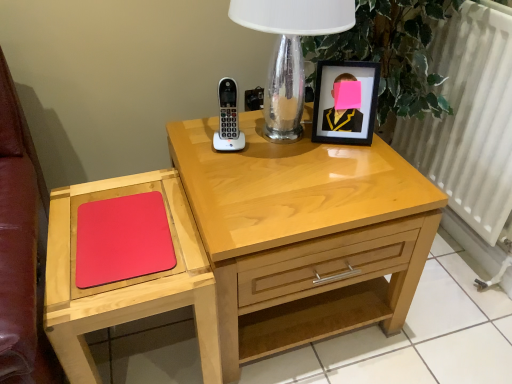
I want to click on white plastic phone at center, so click(x=228, y=119).

The width and height of the screenshot is (512, 384). In order to click on matte wood mouse pad at left in this screenshot , I will do `click(128, 287)`.

What do you see at coordinates (469, 118) in the screenshot? The width and height of the screenshot is (512, 384). I see `white metallic radiator at right` at bounding box center [469, 118].

Where is `white metallic radiator at right`? white metallic radiator at right is located at coordinates (469, 118).

Based on the photo, in order to face light wood nightstand at center, should I rotate leftwards or rightwards?

Turn right by 4.321 degrees to look at light wood nightstand at center.

In order to face matte black picture frame at upper right, should I rotate leftwards or rightwards?

Turn right by 11.741 degrees to look at matte black picture frame at upper right.

Image resolution: width=512 pixels, height=384 pixels. What do you see at coordinates (345, 102) in the screenshot?
I see `matte black picture frame at upper right` at bounding box center [345, 102].

This screenshot has width=512, height=384. In order to click on white plastic phone at center in this screenshot , I will do `click(228, 119)`.

Does white metallic radiator at right lie in front of light wood nightstand at center?

No, it is not.

In the scene shown: Is white metallic radiator at right aimed at light wood nightstand at center?

Yes, white metallic radiator at right is oriented towards light wood nightstand at center.

From the image's perspective, which one is positioned lower, white metallic radiator at right or light wood nightstand at center?

light wood nightstand at center appears lower in the image.

Considering the positions of point (442, 66) and point (264, 210), is point (442, 66) closer or farther from the camera than point (264, 210)?

Point (442, 66) appears to be farther away from the viewer than point (264, 210).

Considering the positions of point (99, 261) and point (297, 46), is point (99, 261) closer or farther from the camera than point (297, 46)?

Point (99, 261) is positioned closer to the camera compared to point (297, 46).

Which is in front, rubberized matte red mousepad at left or clear glass table lamp at upper center?

Positioned in front is rubberized matte red mousepad at left.

Find the location of a particular element. table lamp that appears on the right of rubberized matte red mousepad at left is located at coordinates (290, 51).

Is clear glass table lamp at upper center wider or thinner than matte wood mouse pad at left?

clear glass table lamp at upper center is thinner than matte wood mouse pad at left.

Considering the positions of point (284, 39) and point (147, 291), is point (284, 39) closer or farther from the camera than point (147, 291)?

Point (284, 39) appears to be farther away from the viewer than point (147, 291).

Is clear glass table lamp at upper center further to the viewer compared to matte wood mouse pad at left?

Yes, clear glass table lamp at upper center is further from the camera.

Is clear glass table lamp at upper center smaller than matte wood mouse pad at left?

Indeed, clear glass table lamp at upper center has a smaller size compared to matte wood mouse pad at left.

In the scene shown: Does light wood nightstand at center turn towards clear glass table lamp at upper center?

No, light wood nightstand at center does not turn towards clear glass table lamp at upper center.

Find the location of a particular element. The image size is (512, 384). table lamp above the light wood nightstand at center (from a real-world perspective) is located at coordinates (290, 51).

From a real-world perspective, which object stands above the other?

In real-world perspective, clear glass table lamp at upper center is above.

Consider the image. Between light wood nightstand at center and clear glass table lamp at upper center, which one has larger width?

Wider between the two is light wood nightstand at center.

Is rubberized matte red mousepad at left not within white plastic phone at center?

Indeed, rubberized matte red mousepad at left is completely outside white plastic phone at center.

Which is behind, point (143, 209) or point (231, 146)?

The point (231, 146) is behind.

How different are the orientations of rubberized matte red mousepad at left and white plastic phone at center in degrees?

11.8 degrees separate the facing orientations of rubberized matte red mousepad at left and white plastic phone at center.

Which object is positioned more to the left, rubberized matte red mousepad at left or white plastic phone at center?

rubberized matte red mousepad at left.

From the image's perspective, which object appears higher, white plastic phone at center or light wood nightstand at center?

white plastic phone at center.

Is white plastic phone at center facing away from light wood nightstand at center?

No, white plastic phone at center is not facing away from light wood nightstand at center.

Relative to light wood nightstand at center, is white plastic phone at center in front or behind?

In the image, white plastic phone at center appears behind light wood nightstand at center.

Considering the relative sizes of white plastic phone at center and light wood nightstand at center in the image provided, is white plastic phone at center smaller than light wood nightstand at center?

Indeed, white plastic phone at center has a smaller size compared to light wood nightstand at center.

Looking at this image, in terms of size, does white plastic phone at center appear bigger or smaller than matte wood mouse pad at left?

Clearly, white plastic phone at center is smaller in size than matte wood mouse pad at left.

Does white plastic phone at center turn towards matte wood mouse pad at left?

No, white plastic phone at center is not facing towards matte wood mouse pad at left.

Is the surface of white plastic phone at center in direct contact with matte wood mouse pad at left?

They are not placed beside each other.

Is point (238, 146) positioned before point (71, 186)?

No, (238, 146) is further to viewer.

Image resolution: width=512 pixels, height=384 pixels. In order to click on radiator lying above the light wood nightstand at center (from the image's perspective) in this screenshot , I will do `click(469, 118)`.

I want to click on table lamp located behind the rubberized matte red mousepad at left, so point(290,51).

Estimate the real-world distances between objects in this image. Which object is further from white plastic phone at center, light wood nightstand at center or white metallic radiator at right?

white metallic radiator at right is further to white plastic phone at center.

Considering their positions, is clear glass table lamp at upper center positioned further to white metallic radiator at right than matte black picture frame at upper right?

The object further to white metallic radiator at right is clear glass table lamp at upper center.

From the image, which object appears to be farther from matte wood mouse pad at left, white plastic phone at center or clear glass table lamp at upper center?

Based on the image, clear glass table lamp at upper center appears to be further to matte wood mouse pad at left.

Which object lies nearer to the anchor point clear glass table lamp at upper center, rubberized matte red mousepad at left or matte wood mouse pad at left?

rubberized matte red mousepad at left is positioned closer to the anchor clear glass table lamp at upper center.

Looking at the image, which one is located closer to white metallic radiator at right, matte wood mouse pad at left or rubberized matte red mousepad at left?

matte wood mouse pad at left.

Which object lies nearer to the anchor point white plastic phone at center, matte black picture frame at upper right or matte wood mouse pad at left?

The object closer to white plastic phone at center is matte black picture frame at upper right.

Looking at the image, which one is located further to rubberized matte red mousepad at left, matte wood mouse pad at left or clear glass table lamp at upper center?

Answer: Based on the image, clear glass table lamp at upper center appears to be further to rubberized matte red mousepad at left.

From the image, which object appears to be farther from matte black picture frame at upper right, light wood nightstand at center or matte wood mouse pad at left?

Based on the image, matte wood mouse pad at left appears to be further to matte black picture frame at upper right.

You are a GUI agent. You are given a task and a screenshot of the screen. Output one action in this format:
    pyautogui.click(x=<x>, y=<y>)
    Task: Click on the table lamp between white plastic phone at center and matte black picture frame at upper right from left to right
    The image size is (512, 384).
    Given the screenshot: What is the action you would take?
    pyautogui.click(x=290, y=51)

The image size is (512, 384). I want to click on nightstand between white plastic phone at center and matte wood mouse pad at left vertically, so click(304, 235).

You are a GUI agent. You are given a task and a screenshot of the screen. Output one action in this format:
    pyautogui.click(x=<x>, y=<y>)
    Task: Click on the control between clear glass table lamp at upper center and matte wood mouse pad at left vertically
    Image resolution: width=512 pixels, height=384 pixels.
    Given the screenshot: What is the action you would take?
    pyautogui.click(x=228, y=119)

Identify the location of nightstand between rubberized matte red mousepad at left and white metallic radiator at right in the horizontal direction. This screenshot has width=512, height=384. (304, 235).